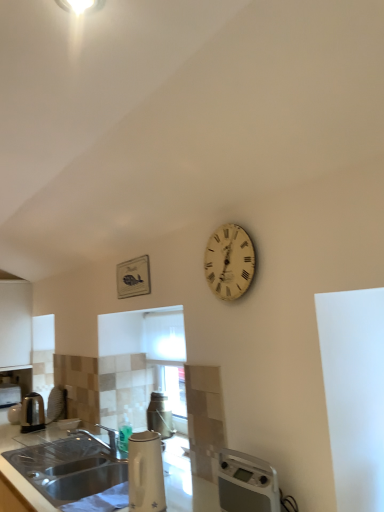
Question: In the image, is white glossy countertop at lower left positioned in front of or behind white wooden clock at upper right?

Choices:
 (A) behind
 (B) front

Answer: (B)

Question: Would you say white glossy countertop at lower left is inside or outside white wooden clock at upper right?

Choices:
 (A) outside
 (B) inside

Answer: (A)

Question: Which object is positioned closest to the white wooden clock at upper right?

Choices:
 (A) white plastic water heater at lower right
 (B) polished stainless steel kettle at left
 (C) white glossy electric kettle at lower center
 (D) white glossy countertop at lower left
 (E) white matte cabinet at left

Answer: (A)

Question: Estimate the real-world distances between objects in this image. Which object is farther from the silver metallic tap at lower left?

Choices:
 (A) white wooden clock at upper right
 (B) white glossy countertop at lower left
 (C) white matte cabinet at left
 (D) polished stainless steel kettle at left
 (E) white plastic water heater at lower right

Answer: (C)